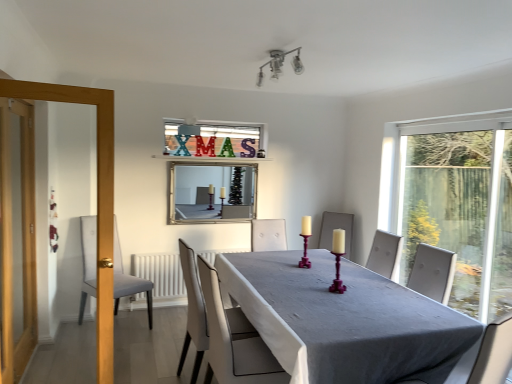
Locate an element on the screen. unoccupied space behind purple wood candle holder at center, placed as the 2th candle holder when sorted from right to left is located at coordinates (293, 263).